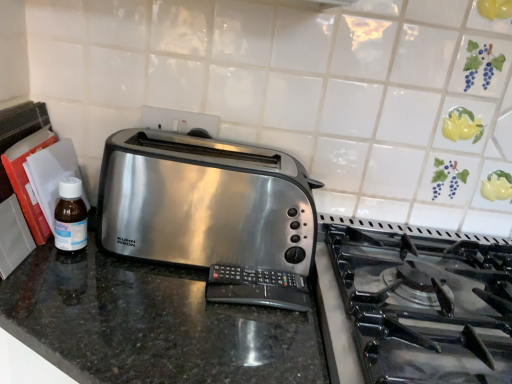
Where is `vacant space to the right of translucent plastic bottle at left`? Image resolution: width=512 pixels, height=384 pixels. vacant space to the right of translucent plastic bottle at left is located at coordinates (140, 277).